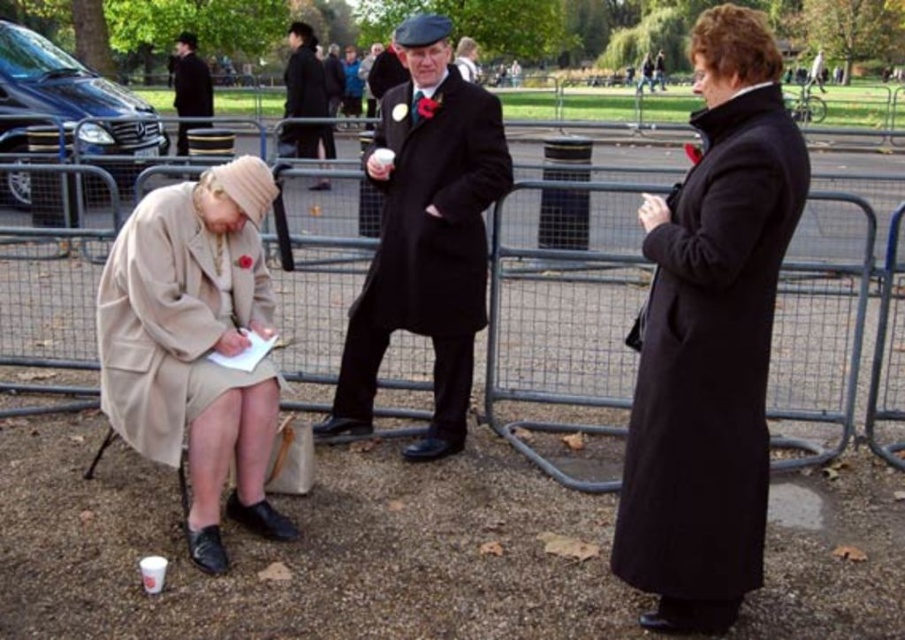
You are planning to place a 1.2 meter wide decorative panel between the metal fence at center and the black wool coat at right. Based on their widths, will the panel fit between them?

The metal fence at center is wider than the black wool coat at right. However, the exact widths are not provided, so it is impossible to determine if the 1.2 meter wide decorative panel will fit between them.

You are a photographer trying to capture a wide shot of the metal fence at center and the black wool coat at upper left. Since you want both objects to appear in the frame, which one should you focus on to ensure both are fully visible?

The metal fence at center is bigger than the black wool coat at upper left, so you should focus on the metal fence at center to ensure both are fully visible.